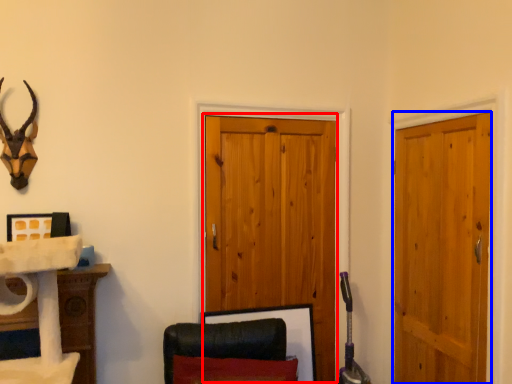
Question: Which point is further to the camera, barn door (highlighted by a red box) or door (highlighted by a blue box)?

Choices:
 (A) barn door
 (B) door

Answer: (A)